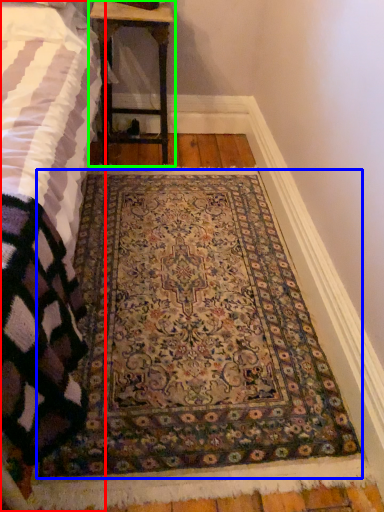
Question: Which is nearer to the bed (highlighted by a red box)? mat (highlighted by a blue box) or table (highlighted by a green box).

Choices:
 (A) mat
 (B) table

Answer: (A)